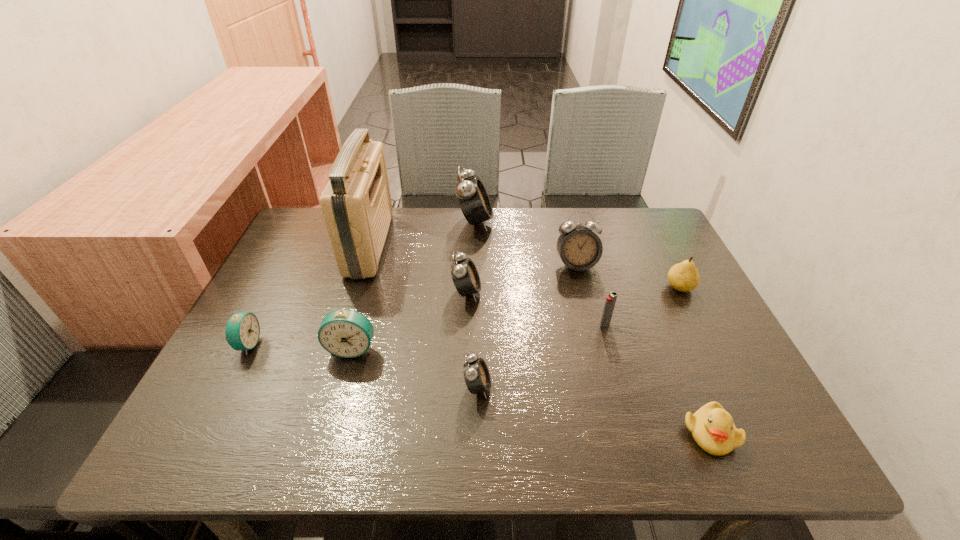
Locate an element on the screen. free region located on the face of the third smallest white alarm clock is located at coordinates (591, 325).

I want to click on vacant region located 0.270m on the face of the second nearest white alarm clock, so click(x=588, y=292).

At what (x,y) coordinates should I click in order to perform the action: click on vacant area located on the front-facing side of the bigger blue alarm clock. Please return your answer as a coordinate pair (x, y). The height and width of the screenshot is (540, 960). Looking at the image, I should click on (336, 404).

Where is `vacant region located 0.340m on the front of the pear`? This screenshot has height=540, width=960. vacant region located 0.340m on the front of the pear is located at coordinates (747, 420).

Where is `vacant space located 0.290m on the left of the igniter`? Image resolution: width=960 pixels, height=540 pixels. vacant space located 0.290m on the left of the igniter is located at coordinates pyautogui.click(x=475, y=324).

Where is `vacant space positioned on the front-facing side of the leftmost object`? vacant space positioned on the front-facing side of the leftmost object is located at coordinates (344, 345).

Image resolution: width=960 pixels, height=540 pixels. In order to click on free space located on the face of the smallest white alarm clock in this screenshot , I will do `click(633, 387)`.

Locate an element on the screen. The height and width of the screenshot is (540, 960). radio receiver present at the far edge is located at coordinates (356, 203).

This screenshot has height=540, width=960. Identify the location of object present at the near edge. (713, 429).

This screenshot has height=540, width=960. Identify the location of object present at the left edge. (242, 331).